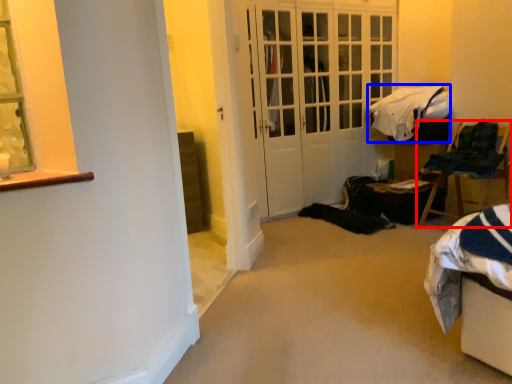
Question: Which point is further to the camera, chair (highlighted by a red box) or blanket (highlighted by a blue box)?

Choices:
 (A) chair
 (B) blanket

Answer: (B)